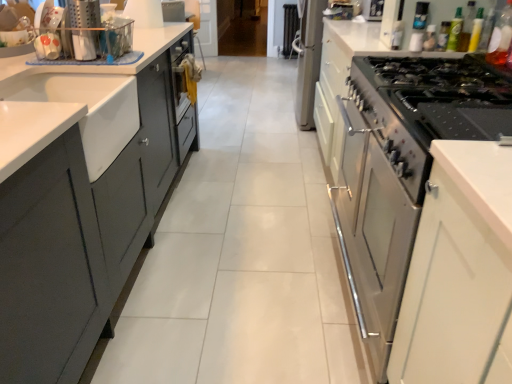
Question: Considering the positions of point (460, 26) and point (471, 18), is point (460, 26) closer or farther from the camera than point (471, 18)?

Choices:
 (A) farther
 (B) closer

Answer: (A)

Question: From a real-world perspective, is green matte bottle at upper right, which is the second bottle in left-to-right order, physically located above or below green glass bottle at upper right, the fourth bottle viewed from the right?

Choices:
 (A) below
 (B) above

Answer: (A)

Question: Which object is positioned closest to the matte plastic utensil holder at upper left?

Choices:
 (A) green glass bottle at upper right, the fourth bottle viewed from the right
 (B) green matte bottle at upper right, which is the second bottle in left-to-right order
 (C) satin white oven at right
 (D) white matte sink at left
 (E) green plastic bottle at upper right, which ranks as the fifth bottle in left-to-right order

Answer: (D)

Question: Which object is positioned farthest from the satin white oven at right?

Choices:
 (A) matte plastic utensil holder at upper left
 (B) green plastic bottle at upper right, which is the 2th bottle from right to left
 (C) transparent plastic bottle at upper right, placed as the 1th bottle when sorted from right to left
 (D) white matte sink at left
 (E) black glass gas stove at right

Answer: (A)